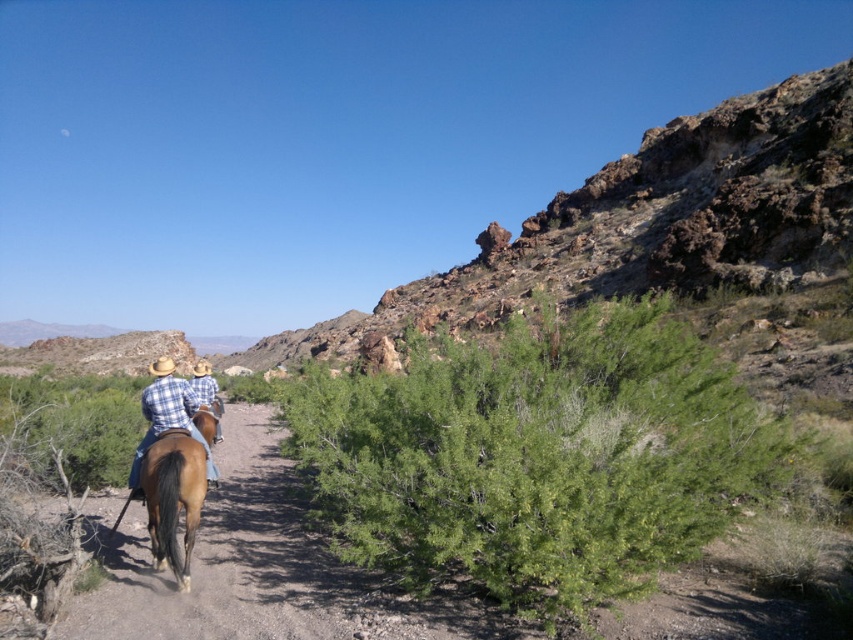
You are a photographer standing in the desert scene. You want to take a closeup photo of the brown glossy horse at center. Considering the distance, can you capture the horse clearly without moving closer?

The brown glossy horse at center is 10.55 meters away from the viewer. With a standard camera lens, capturing a clear closeup at this distance may require zoom capabilities. If your camera has sufficient zoom, you can capture the horse clearly without moving closer.

You are a hiker trying to cross the desert path. You see a green leafy bush at center and a brown glossy horse at center. Which object is closer to you?

The green leafy bush at center is positioned over the brown glossy horse at center, so the green leafy bush at center is closer to you.